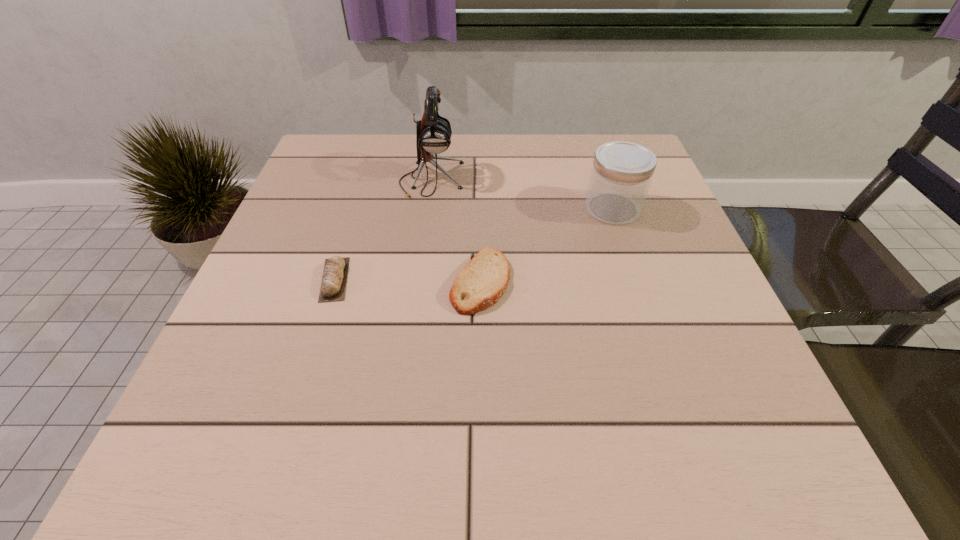
Find the location of a particular element. The width and height of the screenshot is (960, 540). unoccupied position between the left pita bread and the earphone is located at coordinates (383, 230).

The width and height of the screenshot is (960, 540). I want to click on free space between the jar and the right pita bread, so click(x=546, y=245).

The image size is (960, 540). Identify the location of free space between the right pita bread and the rightmost object. (546, 245).

Where is `empty space between the right pita bread and the jar`? empty space between the right pita bread and the jar is located at coordinates (546, 245).

This screenshot has width=960, height=540. Identify the location of free spot between the earphone and the left pita bread. (383, 230).

In order to click on object that is the second nearest to the right pita bread in this screenshot , I will do `click(333, 285)`.

This screenshot has height=540, width=960. I want to click on the closest object to the earphone, so click(x=482, y=282).

In order to click on free space that satisfies the following two spatial constraints: 1. on the back side of the leftmost object; 2. on the right side of the jar in this screenshot , I will do `click(357, 208)`.